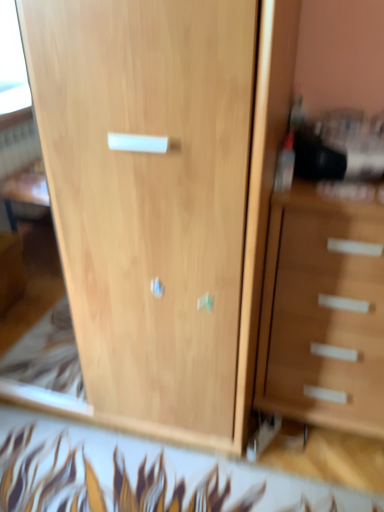
Find the location of a particular element. The width and height of the screenshot is (384, 512). vacant space that is in between wooden chest of drawers at right and light wood cupboard at center is located at coordinates 301,461.